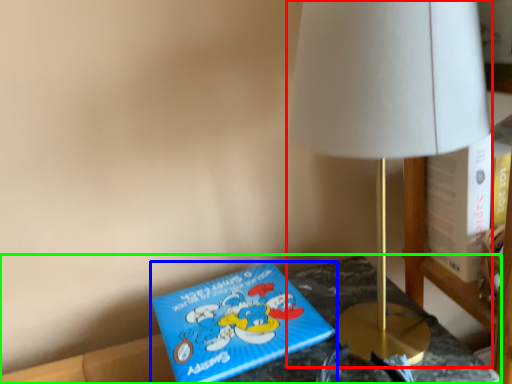
Question: Based on their relative distances, which object is farther from lamp (highlighted by a red box)? Choose from book (highlighted by a blue box) and furniture (highlighted by a green box).

Choices:
 (A) book
 (B) furniture

Answer: (A)